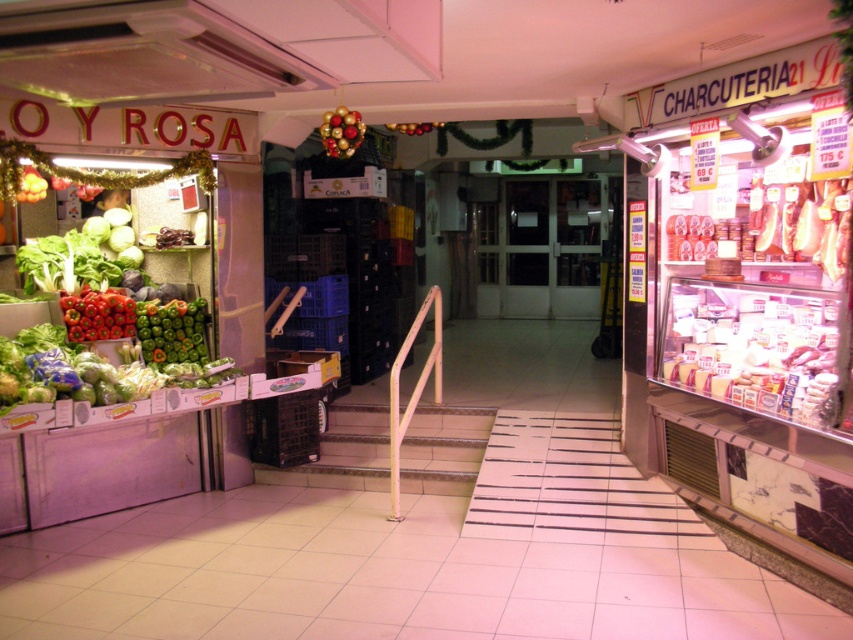
Question: Where is green matte bell peppers at left located in relation to red matte bell peppers at left in the image?

Choices:
 (A) above
 (B) below

Answer: (B)

Question: Is green matte bell peppers at left thinner than glossy red apples at center?

Choices:
 (A) no
 (B) yes

Answer: (B)

Question: Based on their relative distances, which object is farther from the shiny metallic ornaments at center?

Choices:
 (A) green matte bell peppers at left
 (B) glossy red apples at center
 (C) red matte bell peppers at left

Answer: (C)

Question: Which point is closer to the camera?

Choices:
 (A) shiny metallic ornaments at center
 (B) glossy red apples at center

Answer: (A)

Question: Observing the image, what is the correct spatial positioning of red matte bell peppers at left in reference to shiny metallic ornaments at center?

Choices:
 (A) above
 (B) below

Answer: (B)

Question: Which of the following is the closest to the observer?

Choices:
 (A) (123, 308)
 (B) (149, 323)
 (C) (361, 122)
 (D) (421, 124)

Answer: (C)